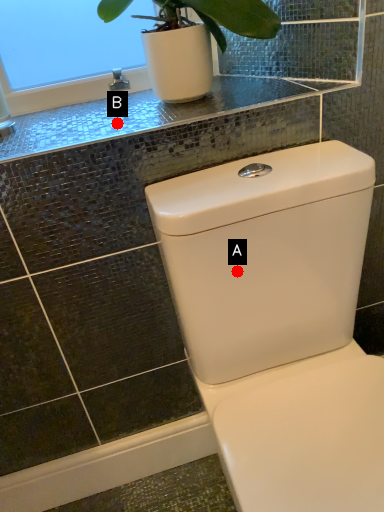
Question: Two points are circled on the image, labeled by A and B beside each circle. Which of the following is the farthest from the observer?

Choices:
 (A) A is further
 (B) B is further

Answer: (B)